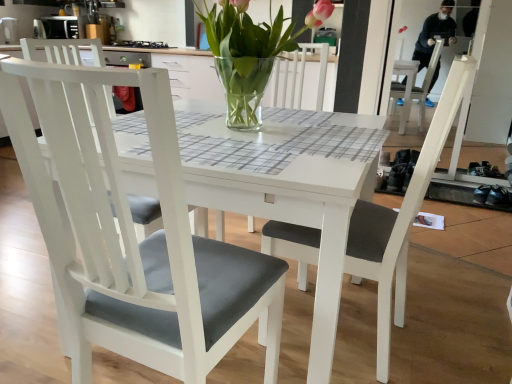
Question: Could you tell me if clear glass vase at center is turned towards matte gray cushioned chair at center, acting as the second chair starting from the left?

Choices:
 (A) yes
 (B) no

Answer: (B)

Question: Is clear glass vase at center to the left of matte gray cushioned chair at center, arranged as the first chair when viewed from the right, from the viewer's perspective?

Choices:
 (A) yes
 (B) no

Answer: (A)

Question: Can you confirm if clear glass vase at center is wider than matte gray cushioned chair at center, acting as the second chair starting from the left?

Choices:
 (A) no
 (B) yes

Answer: (A)

Question: Is clear glass vase at center taller than matte gray cushioned chair at center, arranged as the first chair when viewed from the right?

Choices:
 (A) yes
 (B) no

Answer: (B)

Question: Is there a large distance between clear glass vase at center and matte gray cushioned chair at center, arranged as the first chair when viewed from the right?

Choices:
 (A) yes
 (B) no

Answer: (B)

Question: From their relative heights in the image, would you say white matte chair at left, the second chair when ordered from right to left, is taller or shorter than clear glass vase at center?

Choices:
 (A) short
 (B) tall

Answer: (B)

Question: From a real-world perspective, relative to clear glass vase at center, is white matte chair at left, the second chair when ordered from right to left, vertically above or below?

Choices:
 (A) below
 (B) above

Answer: (A)

Question: Considering the positions of point (23, 162) and point (245, 1), is point (23, 162) closer or farther from the camera than point (245, 1)?

Choices:
 (A) farther
 (B) closer

Answer: (B)

Question: Considering their positions, is white matte chair at left, which is the 1th chair in left-to-right order, located in front of or behind clear glass vase at center?

Choices:
 (A) behind
 (B) front

Answer: (B)

Question: Considering the positions of matte gray cushioned chair at center, acting as the second chair starting from the left, and clear glass vase at center in the image, is matte gray cushioned chair at center, acting as the second chair starting from the left, wider or thinner than clear glass vase at center?

Choices:
 (A) wide
 (B) thin

Answer: (A)

Question: Considering the positions of matte gray cushioned chair at center, arranged as the first chair when viewed from the right, and clear glass vase at center in the image, is matte gray cushioned chair at center, arranged as the first chair when viewed from the right, taller or shorter than clear glass vase at center?

Choices:
 (A) tall
 (B) short

Answer: (A)

Question: Is point (306, 269) closer or farther from the camera than point (236, 114)?

Choices:
 (A) farther
 (B) closer

Answer: (A)

Question: From a real-world perspective, is matte gray cushioned chair at center, acting as the second chair starting from the left, above or below clear glass vase at center?

Choices:
 (A) above
 (B) below

Answer: (B)

Question: From their relative heights in the image, would you say matte gray cushioned chair at center, acting as the second chair starting from the left, is taller or shorter than white matte chair at left, which is the 1th chair in left-to-right order?

Choices:
 (A) short
 (B) tall

Answer: (B)

Question: In terms of width, does matte gray cushioned chair at center, acting as the second chair starting from the left, look wider or thinner when compared to white matte chair at left, which is the 1th chair in left-to-right order?

Choices:
 (A) thin
 (B) wide

Answer: (A)